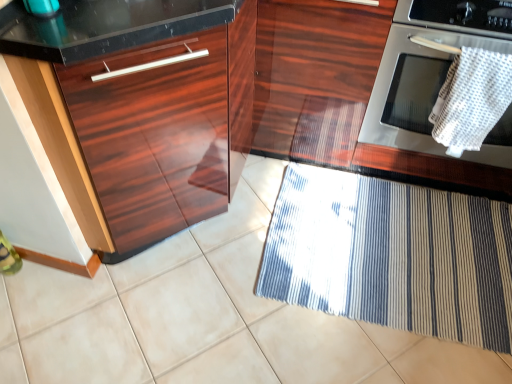
At what (x,y) coordinates should I click in order to perform the action: click on vacant space underneath blue striped mat at lower right (from a real-world perspective). Please return your answer as a coordinate pair (x, y). This screenshot has height=384, width=512. Looking at the image, I should click on (409, 255).